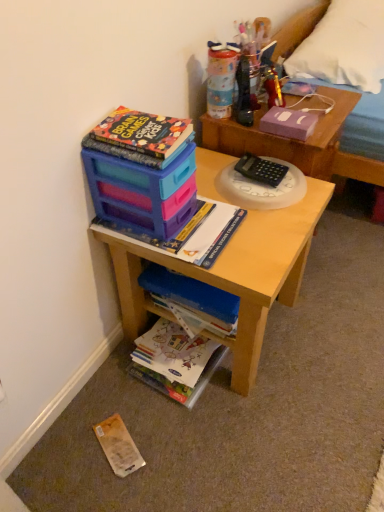
The image size is (384, 512). What are the coordinates of `free space above colored paper art at lower center, arranged as the 1th book when ordered from the bottom (from a real-world perspective)` in the screenshot? It's located at 168,344.